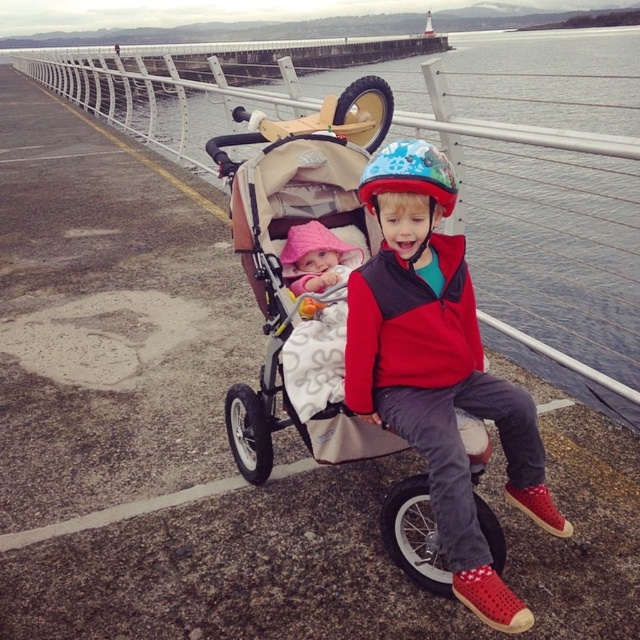
Question: Is red matte helmet at center closer to camera compared to beige fabric stroller at center?

Choices:
 (A) yes
 (B) no

Answer: (A)

Question: Estimate the real-world distances between objects in this image. Which object is farther from the red fleece jacket at center?

Choices:
 (A) beige fabric stroller at center
 (B) red matte helmet at center

Answer: (A)

Question: Which of these objects is positioned farthest from the red matte helmet at center?

Choices:
 (A) red fleece jacket at center
 (B) beige fabric stroller at center
 (C) clear water at upper center

Answer: (C)

Question: Can you confirm if red matte helmet at center is thinner than beige fabric stroller at center?

Choices:
 (A) yes
 (B) no

Answer: (A)

Question: Which of the following is the closest to the observer?

Choices:
 (A) beige fabric stroller at center
 (B) red matte helmet at center
 (C) red fleece jacket at center
 (D) clear water at upper center

Answer: (B)

Question: Is red matte helmet at center thinner than red fleece jacket at center?

Choices:
 (A) no
 (B) yes

Answer: (A)